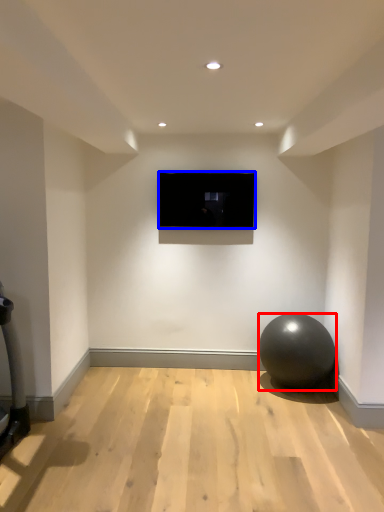
Question: Which object appears closest to the camera in this image, ball (highlighted by a red box) or television (highlighted by a blue box)?

Choices:
 (A) ball
 (B) television

Answer: (A)